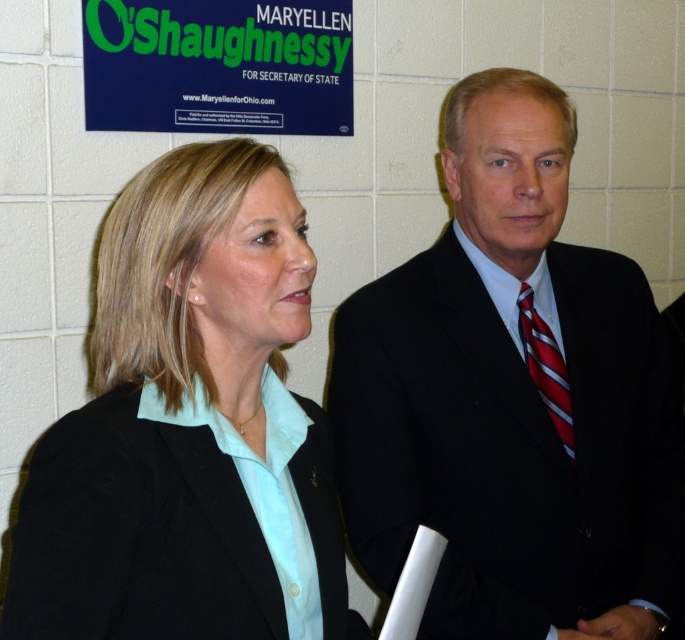
You are a photographer who needs to capture a photo that includes both the matte black blazer at center and the green plastic signboard at upper left. Your camera has a maximum focus range of 1.2 meters. Will you be able to capture both objects in focus at the same time?

The distance between the matte black blazer at center and the green plastic signboard at upper left is 1.10 meters. Since the camera can focus up to 1.2 meters, you can capture both objects in focus simultaneously.

You are a photographer trying to position a spotlight exactly at the center of the black suit at center. According to the coordinates provided, what are the exact coordinates where you should aim the spotlight?

The exact coordinates to aim the spotlight at the center of the black suit at center are point [512,397].

What is the exact location of the green plastic signboard at upper left in the image?

The green plastic signboard at upper left is located at point (216,67).